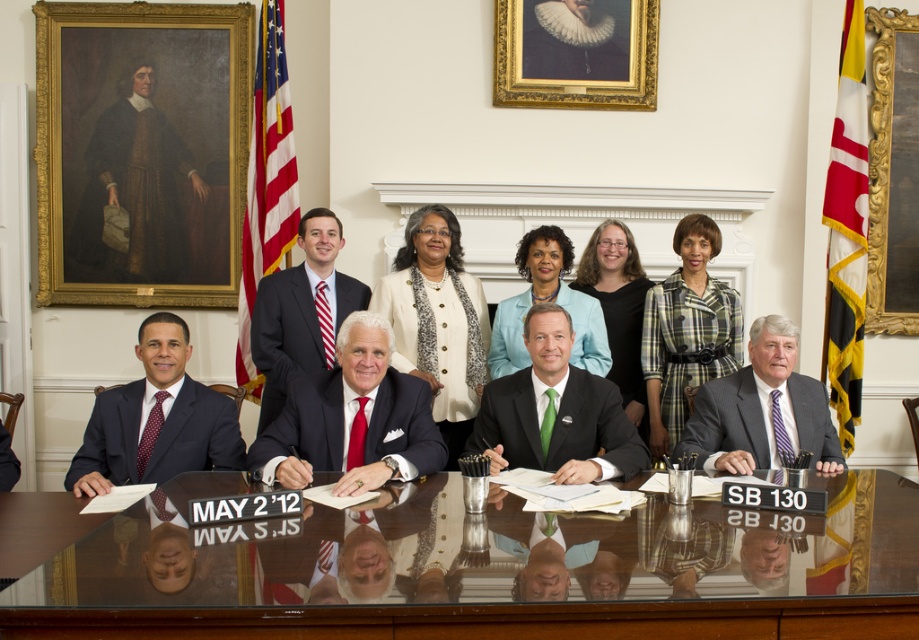
You are a photographer adjusting the lighting for this group photo. You need to ensure that the striped tie at center and the shiny dark suit at center are both well lit. Given that the distance between them is 1.97 meters, will you need to adjust the lighting separately for each or can you use a single light source to adequately illuminate both?

The distance between the striped tie at center and the shiny dark suit at center is 1.97 meters. Since this distance is relatively large, it would be advisable to adjust the lighting separately for each to ensure both are adequately illuminated.

You are a photographer adjusting the lighting for a group photo. You need to ensure that the transparent glass table at center and the matte black suit at center are both well lit. Given the distance between them, can you use a single light source placed between them to evenly illuminate both objects?

The distance between the transparent glass table at center and the matte black suit at center is 18.11 inches. A single light source placed between them can evenly illuminate both objects since the distance is manageable for proper lighting coverage.